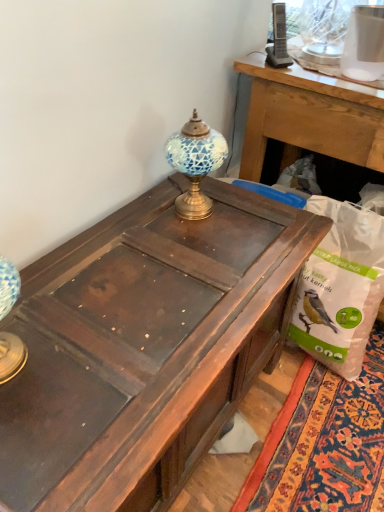
In order to click on blank space situated above dark brown wood desk at center (from a real-world perspective) in this screenshot , I will do `click(148, 296)`.